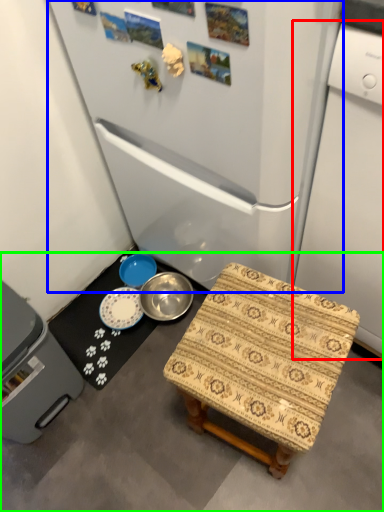
Question: Which object is the closest to the appliance (highlighted by a red box)? Choose among these: refrigerator (highlighted by a blue box) or concrete (highlighted by a green box).

Choices:
 (A) refrigerator
 (B) concrete

Answer: (A)